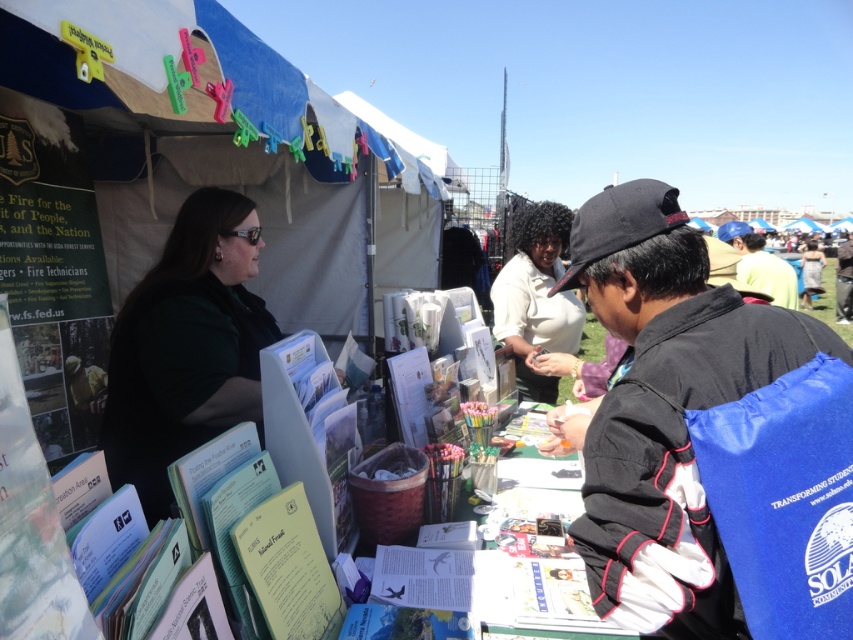
Question: Can you confirm if white glossy shirt at center is positioned below green fabric dress at center?

Choices:
 (A) no
 (B) yes

Answer: (B)

Question: Does black fabric jacket at lower right have a smaller size compared to green fabric dress at center?

Choices:
 (A) yes
 (B) no

Answer: (A)

Question: Which of the following is the closest to the observer?

Choices:
 (A) dark green shirt at left
 (B) white glossy shirt at center
 (C) green fabric dress at center

Answer: (A)

Question: Can you confirm if dark green shirt at left is smaller than black fabric backpack at lower right?

Choices:
 (A) yes
 (B) no

Answer: (A)

Question: Which point is farther to the camera?

Choices:
 (A) (822, 264)
 (B) (750, 266)
 (C) (724, 419)
 (D) (161, 444)

Answer: (A)

Question: Which of the following is the closest to the observer?

Choices:
 (A) (842, 289)
 (B) (763, 257)
 (C) (527, 339)

Answer: (C)